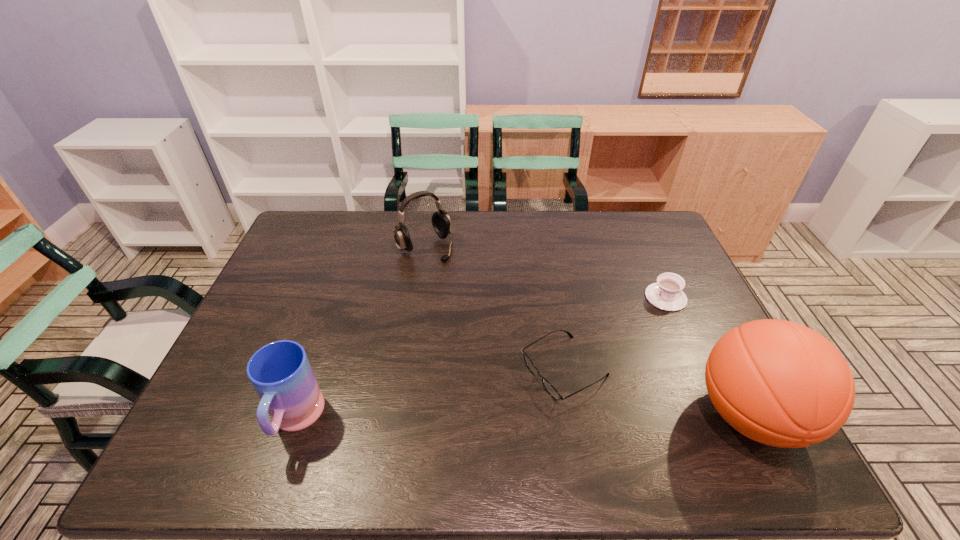
The width and height of the screenshot is (960, 540). What are the coordinates of `vacant space located on the front-facing side of the shortest object` in the screenshot? It's located at (512, 398).

Where is `free location located on the front-facing side of the shortest object`? Image resolution: width=960 pixels, height=540 pixels. free location located on the front-facing side of the shortest object is located at coordinates (498, 406).

I want to click on vacant point located on the handle side of the fourth nearest object, so click(x=594, y=358).

Locate an element on the screen. The height and width of the screenshot is (540, 960). vacant space located 0.160m on the handle side of the fourth nearest object is located at coordinates click(x=622, y=335).

You are a GUI agent. You are given a task and a screenshot of the screen. Output one action in this format:
    pyautogui.click(x=<x>, y=<y>)
    Task: Click on the vacant region located on the handle side of the fourth nearest object
    
    Given the screenshot: What is the action you would take?
    pyautogui.click(x=609, y=346)

Identify the location of free location located with the microphone on the side of the headset. The width and height of the screenshot is (960, 540). (471, 298).

Locate an element on the screen. blank space located with the microphone on the side of the headset is located at coordinates (446, 269).

Image resolution: width=960 pixels, height=540 pixels. Identify the location of vacant region located 0.290m with the microphone on the side of the headset. (488, 316).

Locate an element on the screen. This screenshot has height=540, width=960. object at the far edge is located at coordinates (441, 222).

This screenshot has height=540, width=960. I want to click on mug located in the near edge section of the desktop, so click(280, 372).